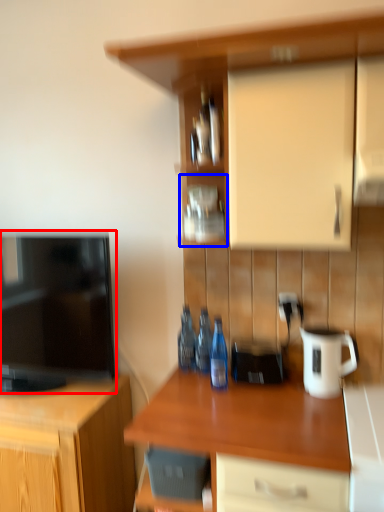
Question: Among these objects, which one is nearest to the camera, television (highlighted by a red box) or shelf (highlighted by a blue box)?

Choices:
 (A) television
 (B) shelf

Answer: (A)